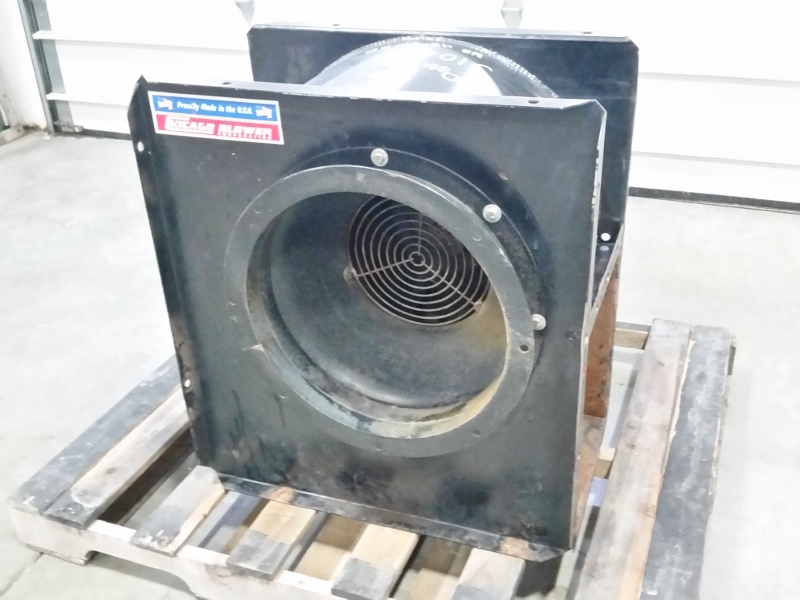
The height and width of the screenshot is (600, 800). Find the location of `floor`. floor is located at coordinates (90, 369).